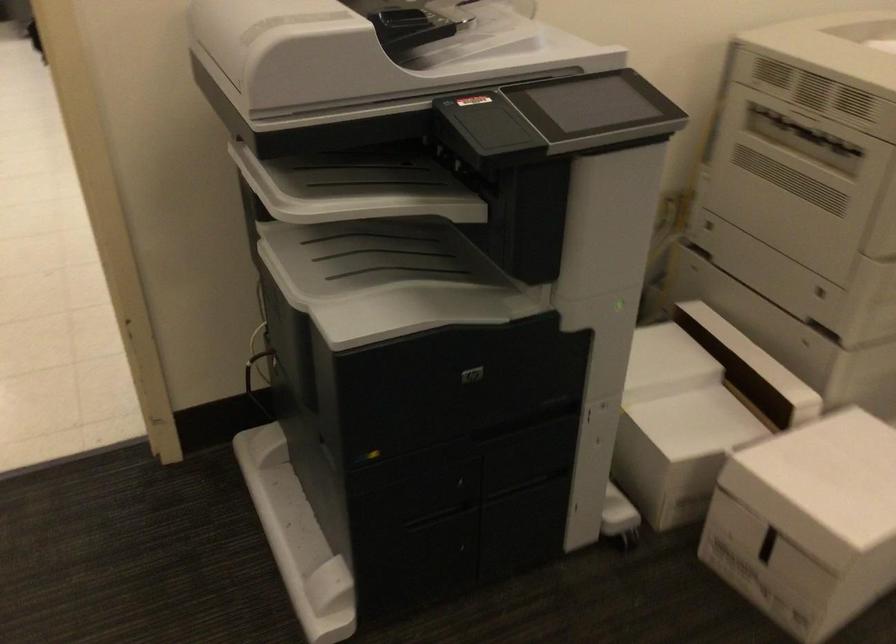
Where is `printer output tray`? The image size is (896, 644). printer output tray is located at coordinates (375, 258).